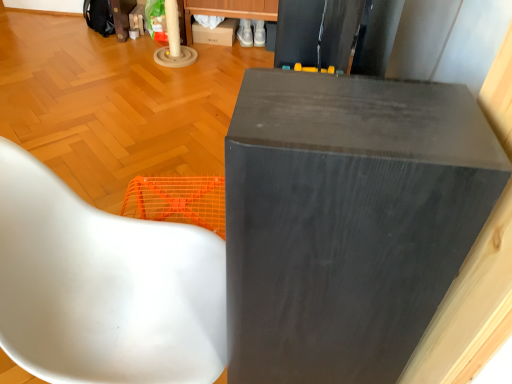
Question: From a real-world perspective, is white glossy chair at lower left positioned under matte black speaker at upper center based on gravity?

Choices:
 (A) no
 (B) yes

Answer: (B)

Question: Is white glossy chair at lower left smaller than matte black speaker at upper center?

Choices:
 (A) yes
 (B) no

Answer: (B)

Question: Is white glossy chair at lower left not near matte black speaker at upper center?

Choices:
 (A) yes
 (B) no

Answer: (B)

Question: Considering the relative positions of white glossy chair at lower left and matte black speaker at upper center in the image provided, is white glossy chair at lower left to the right of matte black speaker at upper center from the viewer's perspective?

Choices:
 (A) yes
 (B) no

Answer: (B)

Question: Does white glossy chair at lower left touch matte black speaker at upper center?

Choices:
 (A) yes
 (B) no

Answer: (B)

Question: Is matte black speaker at upper center wider or thinner than white glossy chair at lower left?

Choices:
 (A) wide
 (B) thin

Answer: (B)

Question: From the image's perspective, is matte black speaker at upper center positioned above or below white glossy chair at lower left?

Choices:
 (A) above
 (B) below

Answer: (B)

Question: Considering their positions, is matte black speaker at upper center located in front of or behind white glossy chair at lower left?

Choices:
 (A) behind
 (B) front

Answer: (B)

Question: Which is correct: matte black speaker at upper center is inside white glossy chair at lower left, or outside of it?

Choices:
 (A) outside
 (B) inside

Answer: (A)

Question: From their relative heights in the image, would you say matte cardboard box at upper center is taller or shorter than matte black speaker at upper center?

Choices:
 (A) short
 (B) tall

Answer: (A)

Question: Is matte cardboard box at upper center in front of or behind matte black speaker at upper center in the image?

Choices:
 (A) behind
 (B) front

Answer: (A)

Question: Looking at their shapes, would you say matte cardboard box at upper center is wider or thinner than matte black speaker at upper center?

Choices:
 (A) wide
 (B) thin

Answer: (A)

Question: Choose the correct answer: Is matte cardboard box at upper center inside matte black speaker at upper center or outside it?

Choices:
 (A) inside
 (B) outside

Answer: (B)

Question: Relative to matte cardboard box at upper center, is matte black speaker at upper center in front or behind?

Choices:
 (A) behind
 (B) front

Answer: (B)

Question: From the image's perspective, is matte black speaker at upper center located above or below matte cardboard box at upper center?

Choices:
 (A) below
 (B) above

Answer: (A)